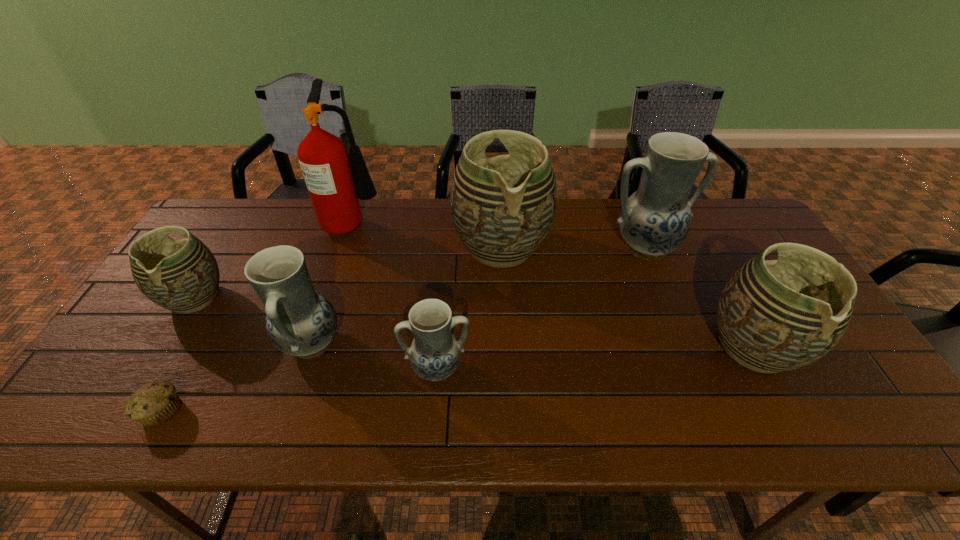
Where is `blank area in the image that satisfies the following two spatial constraints: 1. at the nozzle of the tallest object; 2. on the right side of the biggest brown pottery`? blank area in the image that satisfies the following two spatial constraints: 1. at the nozzle of the tallest object; 2. on the right side of the biggest brown pottery is located at coordinates (345, 247).

Where is `vacant region that satisfies the following two spatial constraints: 1. at the nozzle of the fire extinguisher; 2. on the back side of the second biggest brown pottery`? This screenshot has width=960, height=540. vacant region that satisfies the following two spatial constraints: 1. at the nozzle of the fire extinguisher; 2. on the back side of the second biggest brown pottery is located at coordinates (312, 347).

Identify the location of blank space that satisfies the following two spatial constraints: 1. on the back side of the second brown pottery from left to right; 2. on the left side of the fifth pottery from right to left. The width and height of the screenshot is (960, 540). (343, 247).